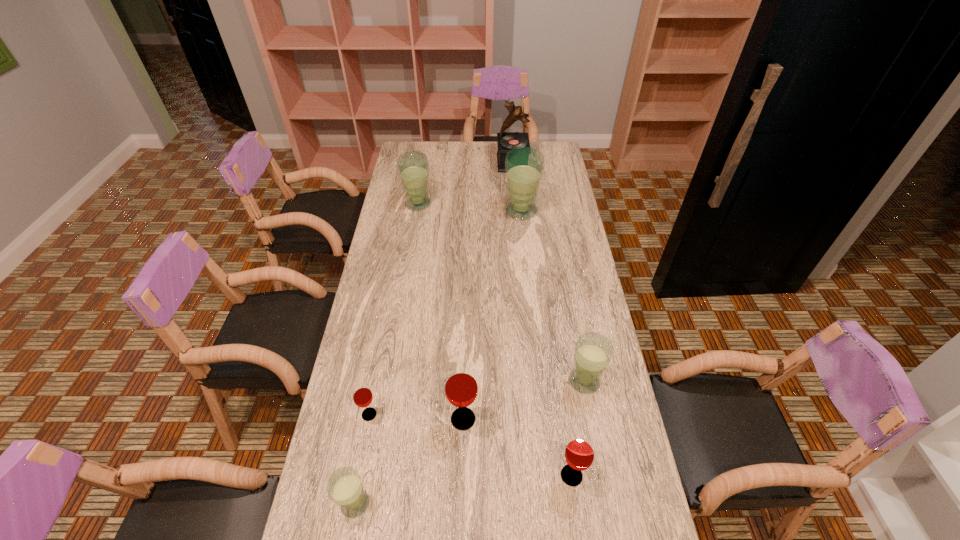
The height and width of the screenshot is (540, 960). In order to click on vacant space situated on the right of the leftmost red glass in this screenshot , I will do `click(413, 414)`.

The image size is (960, 540). What are the coordinates of `vacant space located on the right of the smallest blue glass` in the screenshot? It's located at (494, 503).

Identify the location of object located in the far edge section of the desktop. (506, 141).

In order to click on free space at the far edge of the desktop in this screenshot , I will do `click(474, 143)`.

The height and width of the screenshot is (540, 960). In the image, there is a desktop. Find the location of `vacant region at the right edge`. vacant region at the right edge is located at coordinates (612, 435).

You are a GUI agent. You are given a task and a screenshot of the screen. Output one action in this format:
    pyautogui.click(x=<x>, y=<y>)
    Task: Click on the vacant space at the far right corner of the desktop
    This screenshot has width=960, height=540.
    Given the screenshot: What is the action you would take?
    pyautogui.click(x=553, y=142)

Find the location of `vacant area between the smallest red glass and the second red glass from right to left`. vacant area between the smallest red glass and the second red glass from right to left is located at coordinates (417, 417).

You are a GUI agent. You are given a task and a screenshot of the screen. Output one action in this format:
    pyautogui.click(x=<x>, y=<y>)
    Task: Click on the unoccupied position between the second smallest blue glass and the nearest red glass
    The height and width of the screenshot is (540, 960).
    Given the screenshot: What is the action you would take?
    pyautogui.click(x=578, y=428)

Identify the location of vacant area that lies between the third smallest blue glass and the fourth glass from left to right. The width and height of the screenshot is (960, 540). (441, 312).

This screenshot has width=960, height=540. Find the location of `free space between the leftmost red glass and the nearest red glass`. free space between the leftmost red glass and the nearest red glass is located at coordinates (470, 445).